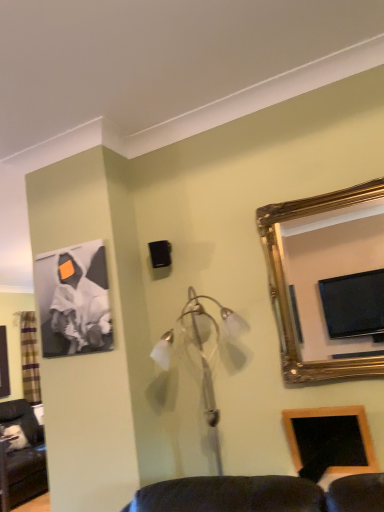
Question: Considering the relative sizes of wooden picture frame at lower right, the 2th picture frame from the back, and plaid fabric curtain at left in the image provided, is wooden picture frame at lower right, the 2th picture frame from the back, bigger than plaid fabric curtain at left?

Choices:
 (A) yes
 (B) no

Answer: (B)

Question: Is plaid fabric curtain at left located within wooden picture frame at lower right, which appears as the second picture frame when viewed from the left?

Choices:
 (A) yes
 (B) no

Answer: (B)

Question: From a real-world perspective, does wooden picture frame at lower right, which is the 1th picture frame in right-to-left order, sit lower than plaid fabric curtain at left?

Choices:
 (A) yes
 (B) no

Answer: (A)

Question: Can you confirm if wooden picture frame at lower right, the first picture frame from the bottom, is taller than plaid fabric curtain at left?

Choices:
 (A) yes
 (B) no

Answer: (B)

Question: Is wooden picture frame at lower right, which appears as the second picture frame when viewed from the top, turned away from plaid fabric curtain at left?

Choices:
 (A) no
 (B) yes

Answer: (A)

Question: Can you confirm if wooden picture frame at lower right, the first picture frame from the bottom, is wider than plaid fabric curtain at left?

Choices:
 (A) no
 (B) yes

Answer: (A)

Question: Is matte black canvas at upper left, which appears as the first picture frame when viewed from the top, facing towards plaid fabric curtain at left?

Choices:
 (A) yes
 (B) no

Answer: (B)

Question: Can you confirm if matte black canvas at upper left, which ranks as the 2th picture frame in front-to-back order, is positioned to the left of plaid fabric curtain at left?

Choices:
 (A) yes
 (B) no

Answer: (B)

Question: Is matte black canvas at upper left, the 2th picture frame positioned from the bottom, oriented away from plaid fabric curtain at left?

Choices:
 (A) yes
 (B) no

Answer: (B)

Question: Does matte black canvas at upper left, the first picture frame positioned from the left, have a greater width compared to plaid fabric curtain at left?

Choices:
 (A) yes
 (B) no

Answer: (B)

Question: From a real-world perspective, is matte black canvas at upper left, the 2th picture frame positioned from the bottom, positioned under plaid fabric curtain at left based on gravity?

Choices:
 (A) no
 (B) yes

Answer: (A)

Question: Is matte black canvas at upper left, which appears as the first picture frame when viewed from the top, positioned behind plaid fabric curtain at left?

Choices:
 (A) yes
 (B) no

Answer: (B)

Question: Would you say matte black canvas at upper left, which ranks as the 2th picture frame in front-to-back order, is outside wooden picture frame at lower right, the first picture frame from the bottom?

Choices:
 (A) no
 (B) yes

Answer: (B)